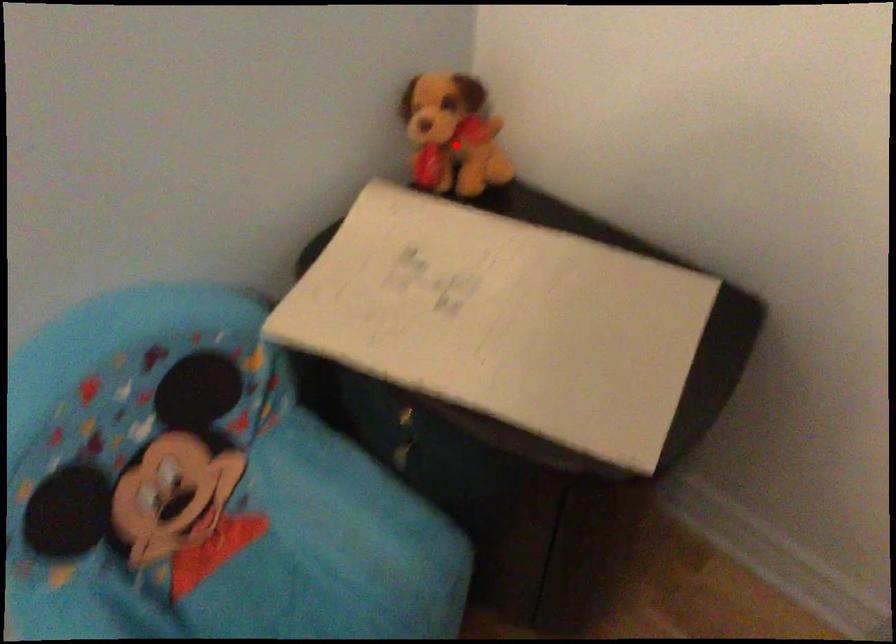
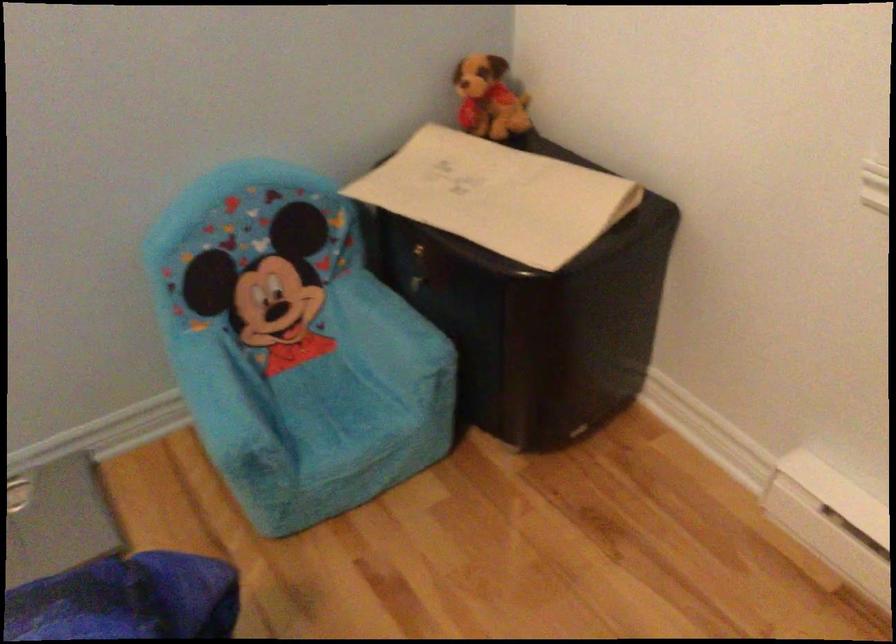
Question: I am providing you with two images of the same scene from different viewpoints. A red point is marked on the first image. Is the red point's position out of view in image 2?

Choices:
 (A) Yes
 (B) No

Answer: (B)